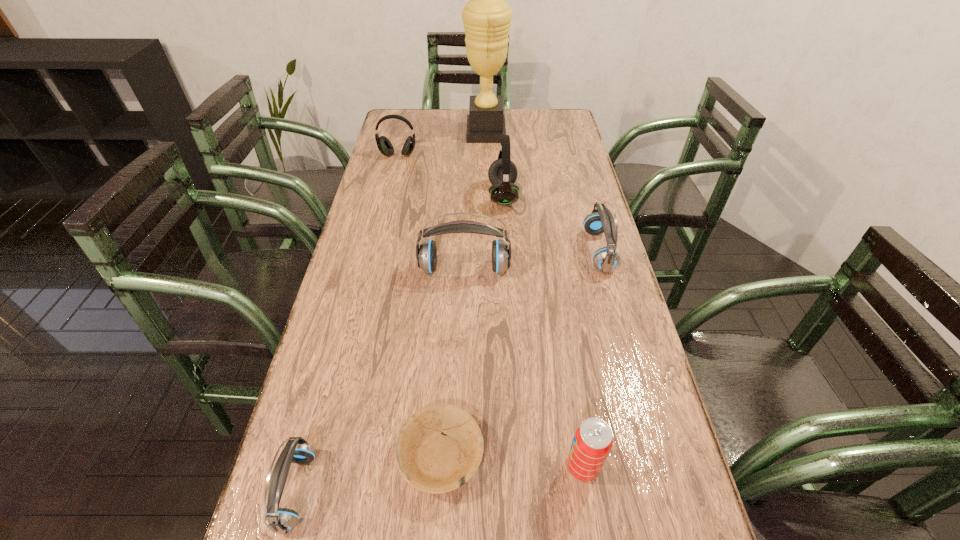
Locate an element on the screen. The image size is (960, 540). the shortest headset is located at coordinates (279, 520).

Locate an element on the screen. the smallest blue headset is located at coordinates (279, 520).

Locate an element on the screen. The height and width of the screenshot is (540, 960). bowl is located at coordinates (432, 462).

Image resolution: width=960 pixels, height=540 pixels. I want to click on blank area located 0.110m at the front of the yellow trophy cup with handles, so click(x=437, y=133).

Where is `blank area located 0.210m at the front of the yellow trophy cup with handles`? The image size is (960, 540). blank area located 0.210m at the front of the yellow trophy cup with handles is located at coordinates (412, 133).

The height and width of the screenshot is (540, 960). What are the coordinates of `free space located 0.070m at the front of the yellow trophy cup with handles` in the screenshot? It's located at (447, 133).

Identify the location of blank space located on the ear cups of the third farthest object. (378, 195).

This screenshot has width=960, height=540. I want to click on blank space located on the ear cups of the third farthest object, so click(378, 195).

At what (x,y) coordinates should I click in order to perform the action: click on blank space located 0.260m on the ear cups of the third farthest object. Please return your answer as a coordinate pair (x, y). The image size is (960, 540). Looking at the image, I should click on (409, 195).

Find the location of a particular element. This screenshot has width=960, height=540. vacant space located 0.180m on the ear cups of the second blue headset from left to right is located at coordinates (462, 335).